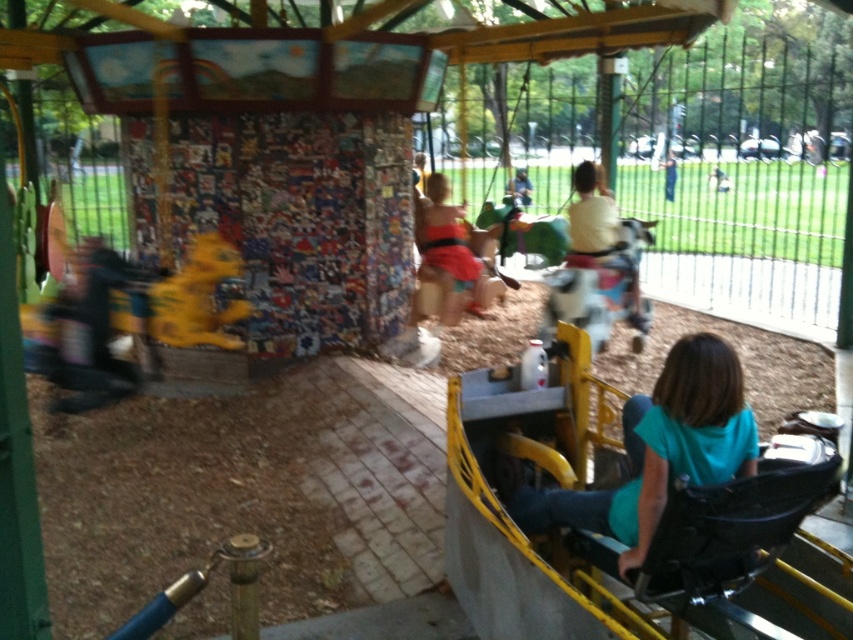
Who is lower down, matte yellow swing at center or dark blue jeans at center?

matte yellow swing at center

Identify the location of matte yellow swing at center. The height and width of the screenshot is (640, 853). (445, 250).

Does matte yellow swing at center appear on the right side of white cotton shirt at center?

Incorrect, matte yellow swing at center is not on the right side of white cotton shirt at center.

Where is `matte yellow swing at center`? The height and width of the screenshot is (640, 853). matte yellow swing at center is located at coordinates (445, 250).

Who is more forward, (572, 224) or (671, 189)?

Point (572, 224)

Between white cotton shirt at center and dark blue jeans at center, which one has more height?

dark blue jeans at center is taller.

Does point (581, 250) come closer to viewer compared to point (665, 177)?

Yes, it is.

You are a GUI agent. You are given a task and a screenshot of the screen. Output one action in this format:
    pyautogui.click(x=<x>, y=<y>)
    Task: Click on the white cotton shirt at center
    
    Given the screenshot: What is the action you would take?
    pyautogui.click(x=592, y=216)